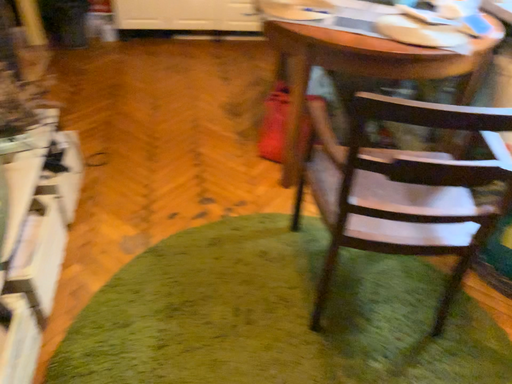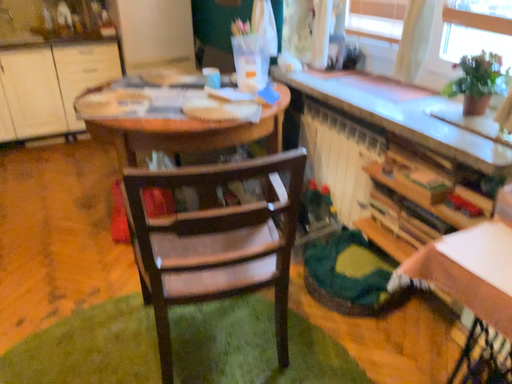
Question: Which way did the camera rotate in the video?

Choices:
 (A) rotated right
 (B) rotated left

Answer: (A)